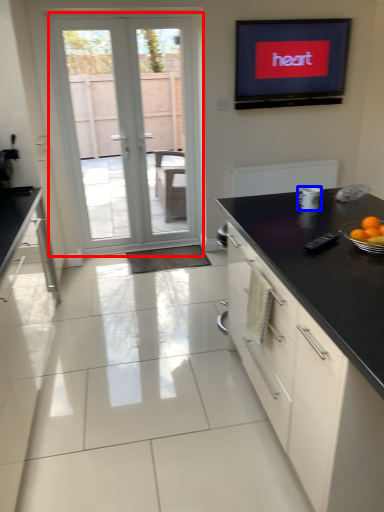
Question: Which point is closer to the camera, door (highlighted by a red box) or appliance (highlighted by a blue box)?

Choices:
 (A) door
 (B) appliance

Answer: (B)